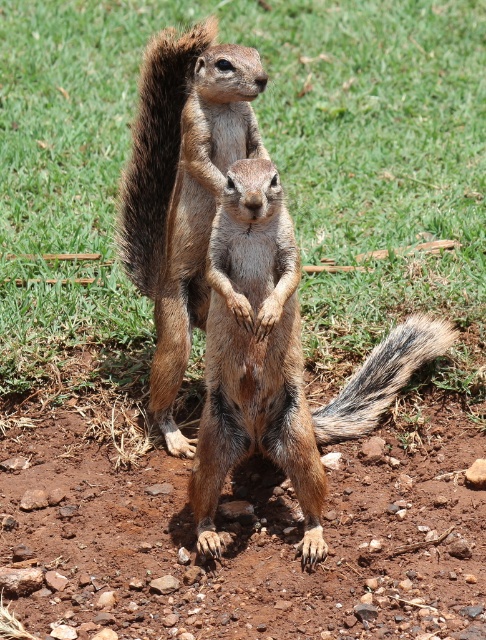
Can you confirm if green grass at center is shorter than brown fur squirrel at center?

In fact, green grass at center may be taller than brown fur squirrel at center.

Who is shorter, green grass at center or brown fur squirrel at center?

brown fur squirrel at center

Does point (306, 122) come farther from viewer compared to point (162, 406)?

Yes, point (306, 122) is behind point (162, 406).

Identify the location of green grass at center. (375, 154).

Does green grass at center appear under gray-brown fur tail at center?

Actually, green grass at center is above gray-brown fur tail at center.

How far apart are green grass at center and gray-brown fur tail at center?

1.47 meters

Does point (85, 323) come farther from viewer compared to point (441, 344)?

Yes, point (85, 323) is farther from viewer.

Locate an element on the screen. green grass at center is located at coordinates (375, 154).

Between brown fur squirrel at center and gray-brown fur tail at center, which one is positioned higher?

Positioned higher is brown fur squirrel at center.

Between brown fur squirrel at center and gray-brown fur tail at center, which one appears on the left side from the viewer's perspective?

brown fur squirrel at center is more to the left.

Is point (202, 49) farther from camera compared to point (416, 324)?

No, (202, 49) is closer to viewer.

Where is `brown fur squirrel at center`? This screenshot has width=486, height=640. brown fur squirrel at center is located at coordinates (183, 188).